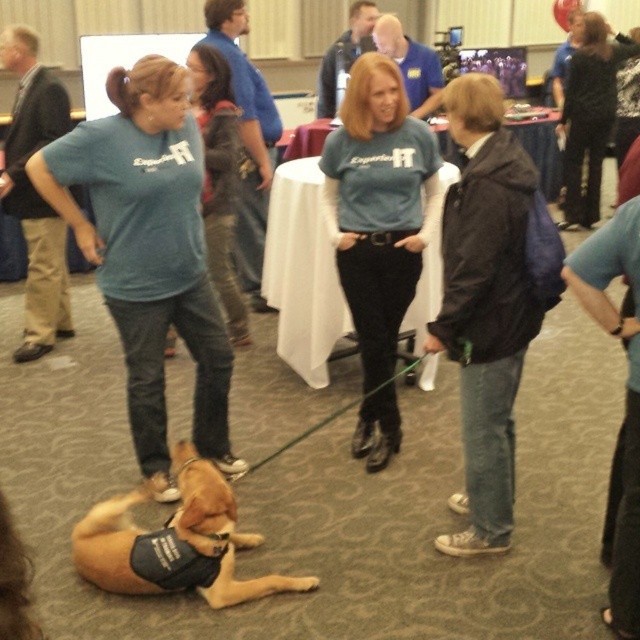
Question: Which of these objects is positioned farthest from the matte blue shirt at center?

Choices:
 (A) blue cotton shirt at center
 (B) blue t-shirt at center
 (C) golden brown fur at center

Answer: (B)

Question: Can you confirm if matte blue shirt at center is positioned to the left of blue t-shirt at center?

Choices:
 (A) yes
 (B) no

Answer: (A)

Question: Which of the following is the farthest from the observer?

Choices:
 (A) matte blue shirt at center
 (B) blue cotton shirt at center

Answer: (B)

Question: Does dark blue jacket at center-right appear over blue cotton shirt at center?

Choices:
 (A) no
 (B) yes

Answer: (A)

Question: Is dark blue jacket at center-right bigger than blue t-shirt at center?

Choices:
 (A) yes
 (B) no

Answer: (A)

Question: Estimate the real-world distances between objects in this image. Which object is farther from the blue t-shirt at center?

Choices:
 (A) golden brown fur at center
 (B) dark blue jacket at center-right
 (C) blue cotton shirt at center

Answer: (B)